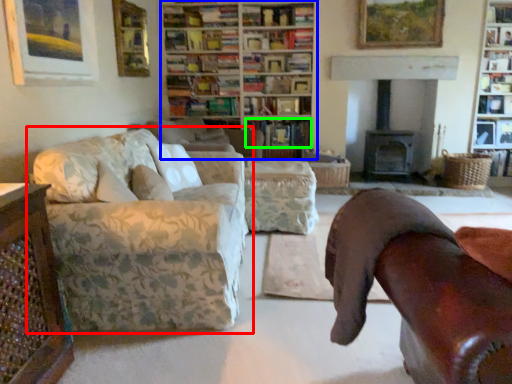
Question: Considering the real-world distances, which object is farthest from studio couch (highlighted by a red box)? bookcase (highlighted by a blue box) or book (highlighted by a green box)?

Choices:
 (A) bookcase
 (B) book

Answer: (A)